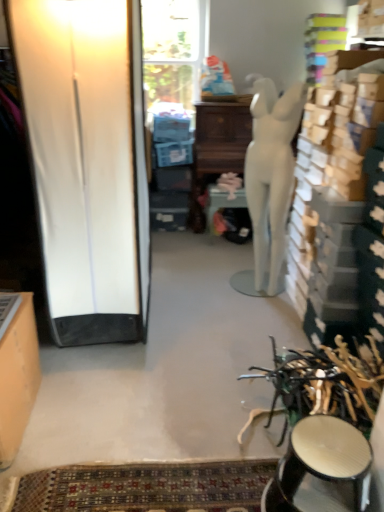
I want to click on free space that is in between matte orange cabinet at left and white glossy screen door at left, so click(85, 401).